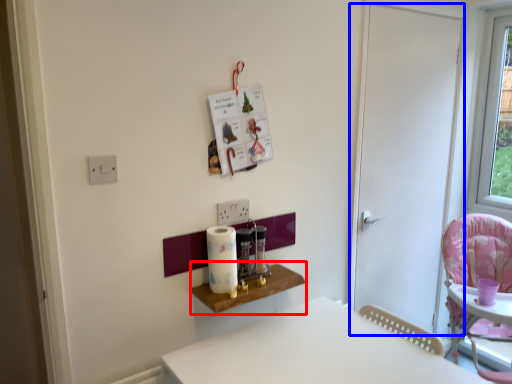
Question: Which of the following is the farthest to the observer, table (highlighted by a red box) or door (highlighted by a blue box)?

Choices:
 (A) table
 (B) door

Answer: (B)